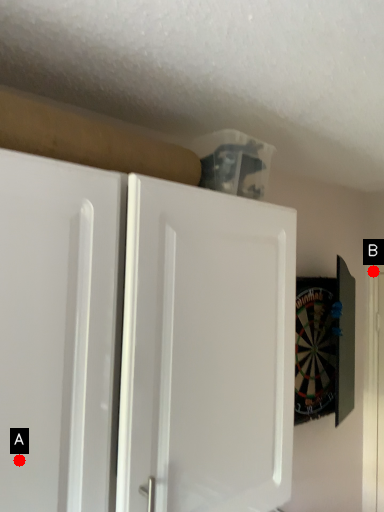
Question: Two points are circled on the image, labeled by A and B beside each circle. Which point is closer to the camera?

Choices:
 (A) A is closer
 (B) B is closer

Answer: (A)